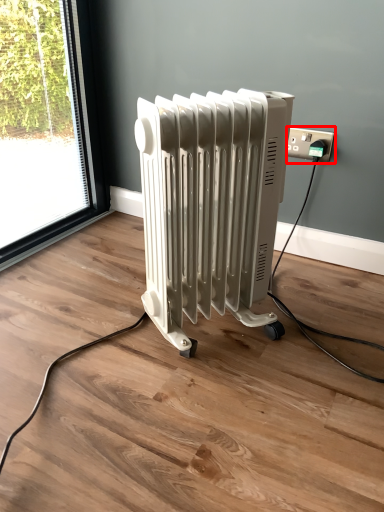
Question: From the image's perspective, considering the relative positions of power plugs and sockets (annotated by the red box) and radiator in the image provided, where is power plugs and sockets (annotated by the red box) located with respect to the staircase?

Choices:
 (A) above
 (B) below

Answer: (A)